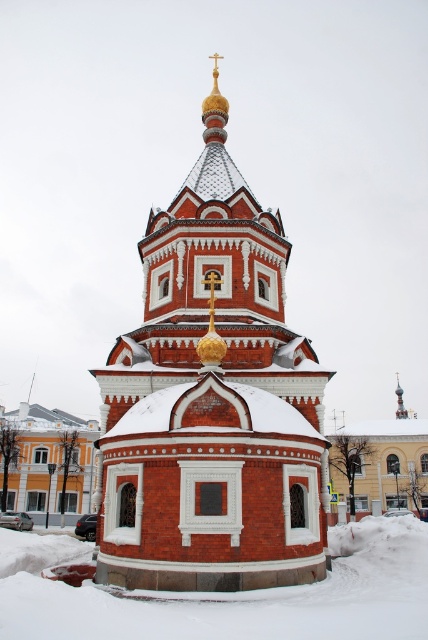
Who is more forward, (181, 394) or (48, 544)?

Point (181, 394) is in front.

This screenshot has height=640, width=428. In order to click on red brick church steeple at center in this screenshot , I will do `click(211, 401)`.